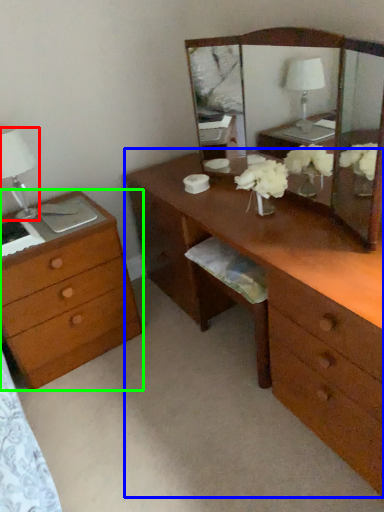
Question: Which is farther away from table lamp (highlighted by a red box)? desk (highlighted by a blue box) or chest of drawers (highlighted by a green box)?

Choices:
 (A) desk
 (B) chest of drawers

Answer: (A)